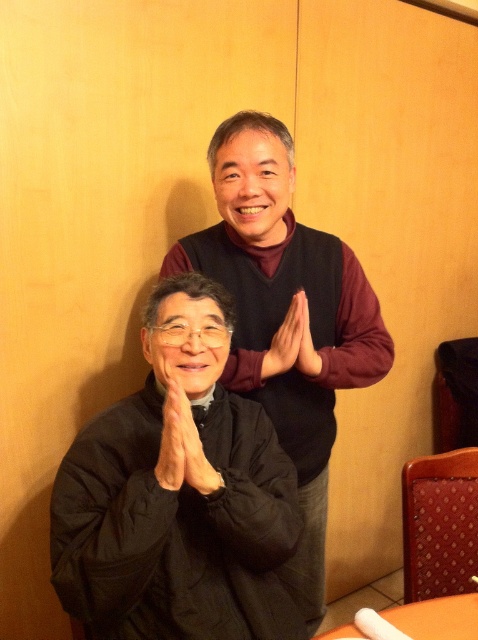
Is black matte robe at lower left thinner than black matte jacket at center?

Yes, black matte robe at lower left is thinner than black matte jacket at center.

Does black matte robe at lower left have a lesser height compared to black matte jacket at center?

Yes.

The image size is (478, 640). What do you see at coordinates (175, 528) in the screenshot?
I see `black matte robe at lower left` at bounding box center [175, 528].

At what (x,y) coordinates should I click in order to perform the action: click on black matte robe at lower left. Please return your answer as a coordinate pair (x, y). This screenshot has width=478, height=640. Looking at the image, I should click on click(x=175, y=528).

Measure the distance between black matte jacket at center and camera.

They are 1.16 meters apart.

Between black matte jacket at center and matte black hands at center, which one is positioned higher?

matte black hands at center is above.

What are the coordinates of `black matte jacket at center` in the screenshot? It's located at (284, 316).

At what (x,y) coordinates should I click in order to perform the action: click on black matte jacket at center. Please return your answer as a coordinate pair (x, y). This screenshot has height=640, width=478. Looking at the image, I should click on (284, 316).

Is black matte robe at lower left to the left of orange plastic table at lower right from the viewer's perspective?

Correct, you'll find black matte robe at lower left to the left of orange plastic table at lower right.

Does black matte robe at lower left come in front of orange plastic table at lower right?

That is True.

Does point (74, 572) come farther from viewer compared to point (422, 605)?

No.

Locate an element on the screen. The image size is (478, 640). black matte robe at lower left is located at coordinates (175, 528).